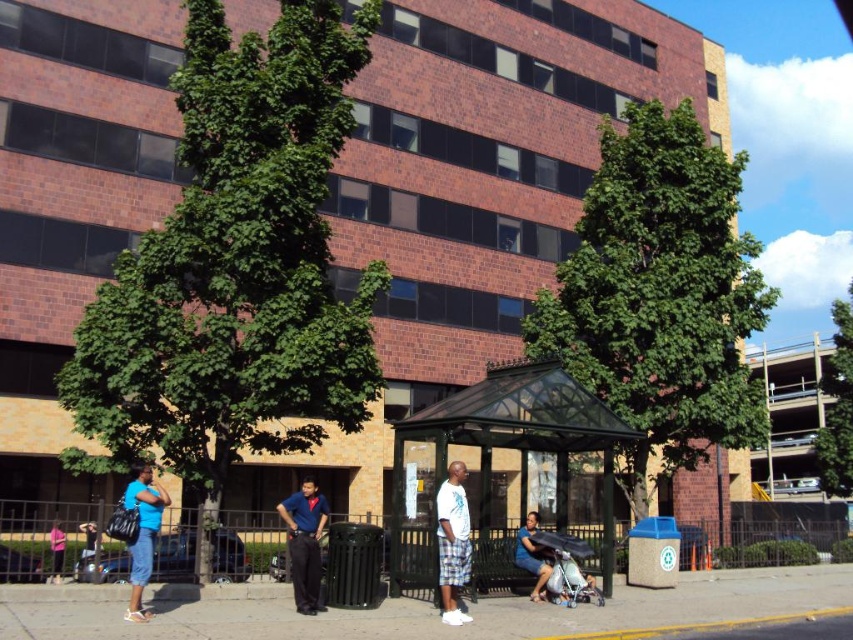
Between point (635, 272) and point (59, 573), which one is positioned behind?

Point (635, 272)

Between green leafy tree at center and blue denim shorts at lower left, which one has more height?

Standing taller between the two is green leafy tree at center.

Identify the location of green leafy tree at center. (660, 298).

Does green leafy tree at left have a greater height compared to green leafy tree at center?

No.

Between green leafy tree at left and green leafy tree at center, which one appears on the left side from the viewer's perspective?

green leafy tree at left

Is point (241, 308) in front of point (627, 490)?

Yes, point (241, 308) is closer to viewer.

At what (x,y) coordinates should I click in order to perform the action: click on green leafy tree at left. Please return your answer as a coordinate pair (x, y). Looking at the image, I should click on (235, 269).

Measure the distance between green transparent bus stop at center and green leafy tree at right.

green transparent bus stop at center is 27.36 meters from green leafy tree at right.

Which of these two, green transparent bus stop at center or green leafy tree at right, stands taller?

green leafy tree at right is taller.

Does point (496, 372) come farther from viewer compared to point (822, 385)?

No.

Identify the location of green transparent bus stop at center. This screenshot has width=853, height=640. (505, 468).